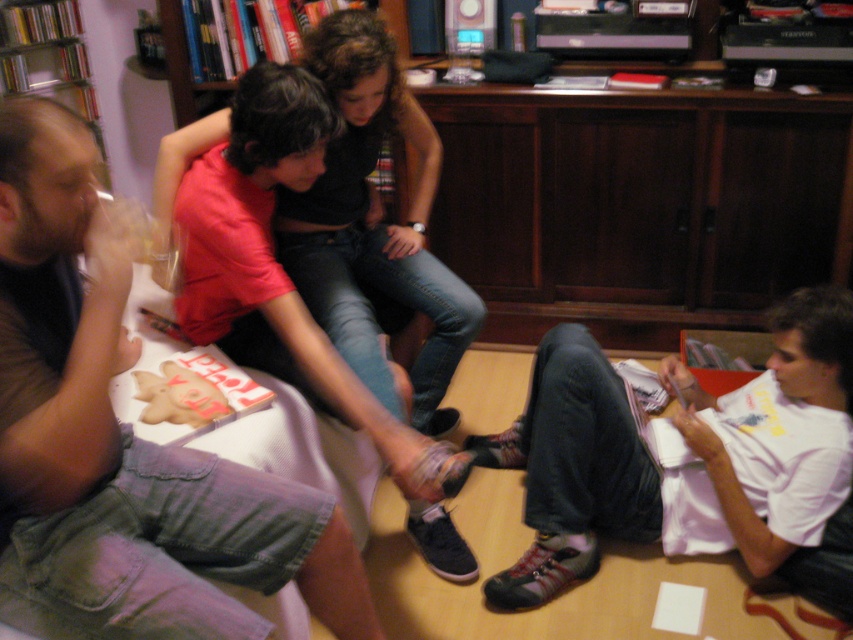
Is denim shorts at left shorter than matte red shirt at center?

Yes.

Which is behind, point (54, 394) or point (242, 81)?

Positioned behind is point (242, 81).

The width and height of the screenshot is (853, 640). What do you see at coordinates (126, 432) in the screenshot?
I see `denim shorts at left` at bounding box center [126, 432].

Find the location of a particular element. This screenshot has height=640, width=853. denim shorts at left is located at coordinates (126, 432).

Can you confirm if white fabric shirt at lower right is taller than matte red shirt at center?

No, white fabric shirt at lower right is not taller than matte red shirt at center.

Find the location of a particular element. white fabric shirt at lower right is located at coordinates (688, 445).

This screenshot has width=853, height=640. I want to click on white fabric shirt at lower right, so click(688, 445).

Who is lower down, denim shorts at left or white fabric shirt at lower right?

white fabric shirt at lower right is lower down.

Who is more forward, (73, 518) or (839, 300)?

Point (73, 518) is in front.

Which is behind, point (254, 492) or point (793, 364)?

Positioned behind is point (793, 364).

At what (x,y) coordinates should I click in order to perform the action: click on denim shorts at left. Please return your answer as a coordinate pair (x, y). This screenshot has width=853, height=640. Looking at the image, I should click on (126, 432).